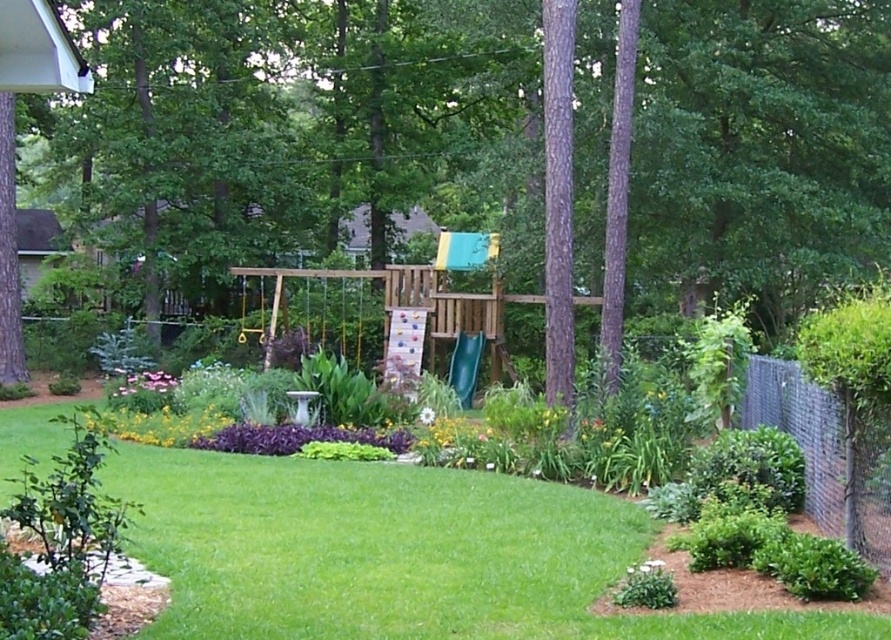
Question: Observing the image, what is the correct spatial positioning of green leafy tree at center in reference to gray wire mesh fence at right?

Choices:
 (A) below
 (B) above

Answer: (B)

Question: Which object appears closest to the camera in this image?

Choices:
 (A) green plastic slide at center
 (B) green rough bark tree at center
 (C) brown rough bark tree at center

Answer: (B)

Question: Which object is positioned farthest from the brown rough bark tree at center?

Choices:
 (A) gray wire mesh fence at right
 (B) pink matte flower at lower left
 (C) green leafy tree at center

Answer: (C)

Question: Which object is closer to the camera taking this photo?

Choices:
 (A) gray wire mesh fence at right
 (B) green leafy tree at center
 (C) pink matte flower at lower left

Answer: (A)

Question: Does gray wire mesh fence at right have a larger size compared to green rough bark tree at center?

Choices:
 (A) yes
 (B) no

Answer: (B)

Question: Does green leafy tree at center appear under brown rough bark tree at center?

Choices:
 (A) no
 (B) yes

Answer: (A)